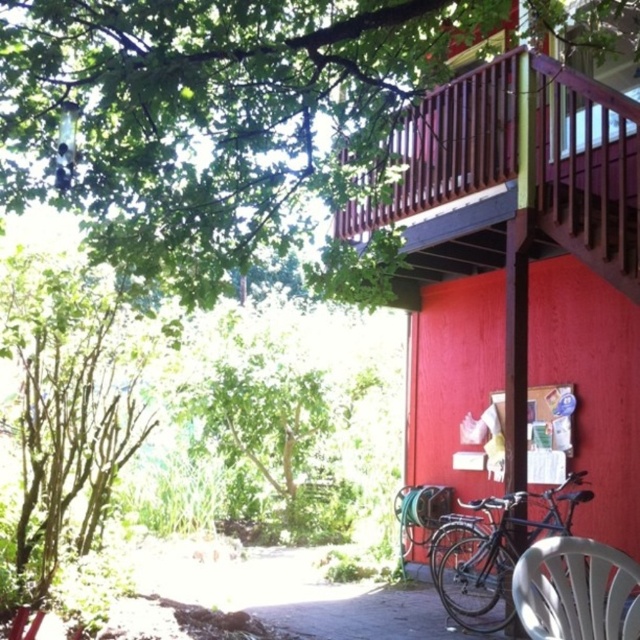
Who is positioned more to the left, red matte wood shed at center or shiny black bicycle at lower right?

Positioned to the left is shiny black bicycle at lower right.

Can you confirm if red matte wood shed at center is positioned above shiny black bicycle at lower right?

Indeed, red matte wood shed at center is positioned over shiny black bicycle at lower right.

Who is more forward, [547,278] or [460,573]?

Positioned in front is point [460,573].

Where is `red matte wood shed at center`? red matte wood shed at center is located at coordinates (522, 268).

Does green leafy tree at left appear under white plastic chair at lower right?

No.

Is point (88, 396) positioned before point (632, 634)?

No, (88, 396) is behind (632, 634).

Which is behind, point (49, 488) or point (563, 637)?

Positioned behind is point (49, 488).

Identify the location of green leafy tree at left. The image size is (640, 640). (67, 406).

Is red matte wood shed at center shorter than green leafy tree at left?

No, red matte wood shed at center is not shorter than green leafy tree at left.

Between red matte wood shed at center and green leafy tree at left, which one has less height?

Standing shorter between the two is green leafy tree at left.

Image resolution: width=640 pixels, height=640 pixels. In order to click on red matte wood shed at center in this screenshot , I will do `click(522, 268)`.